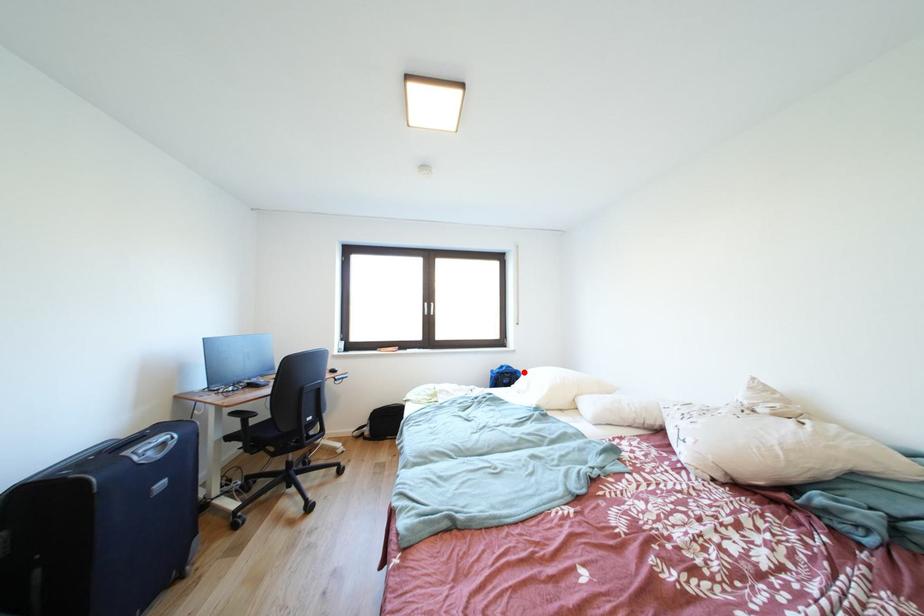
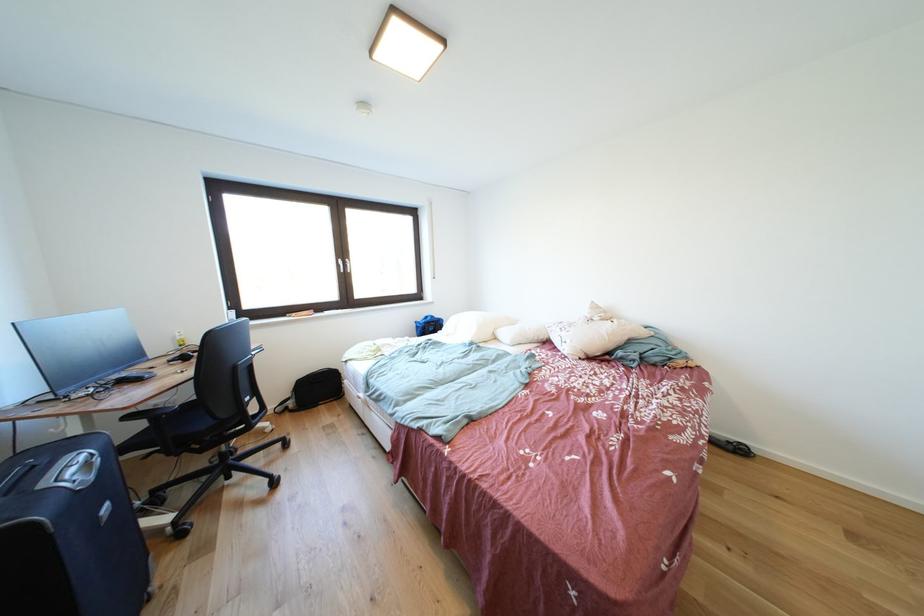
Question: I am providing you with two images of the same scene from different viewpoints. Image1 has a red point marked. In image2, the corresponding 3D location appears at what relative position? Reply with the corresponding letter.

Choices:
 (A) Closer
 (B) Farther

Answer: (A)